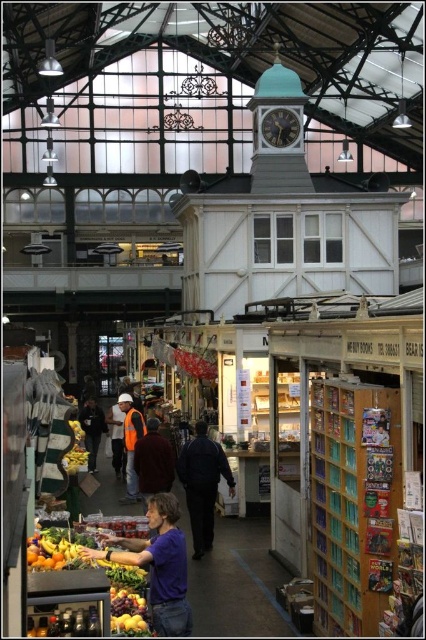
Can you confirm if shiny yellow bananas at center is positioned to the left of reflective orange vest at center?

Incorrect, shiny yellow bananas at center is not on the left side of reflective orange vest at center.

The image size is (426, 640). Identify the location of shiny yellow bananas at center. (94, 566).

I want to click on shiny yellow bananas at center, so click(94, 566).

Measure the distance from shiny yellow bananas at center to shiny yellow lemon at lower center.

They are 4.72 feet apart.

Who is positioned more to the right, shiny yellow bananas at center or shiny yellow lemon at lower center?

shiny yellow lemon at lower center

At what (x,y) coordinates should I click in order to perform the action: click on shiny yellow bananas at center. Please return your answer as a coordinate pair (x, y). The height and width of the screenshot is (640, 426). Looking at the image, I should click on (94, 566).

Between point (198, 520) and point (52, 560), which one is positioned behind?

Positioned behind is point (198, 520).

Is dark blue jacket at center to the right of shiny yellow bananas at lower left from the viewer's perspective?

Yes, dark blue jacket at center is to the right of shiny yellow bananas at lower left.

Where is `dark blue jacket at center`? The width and height of the screenshot is (426, 640). dark blue jacket at center is located at coordinates (203, 484).

Identify the location of dark blue jacket at center. This screenshot has width=426, height=640. (203, 484).